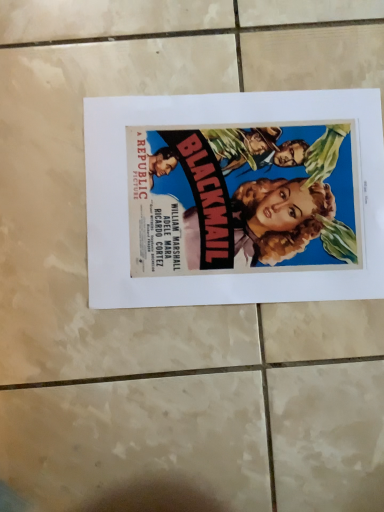
The image size is (384, 512). What do you see at coordinates (234, 198) in the screenshot? I see `matte paper poster at center` at bounding box center [234, 198].

Where is `matte paper poster at center`? matte paper poster at center is located at coordinates (234, 198).

The image size is (384, 512). I want to click on matte paper poster at center, so click(234, 198).